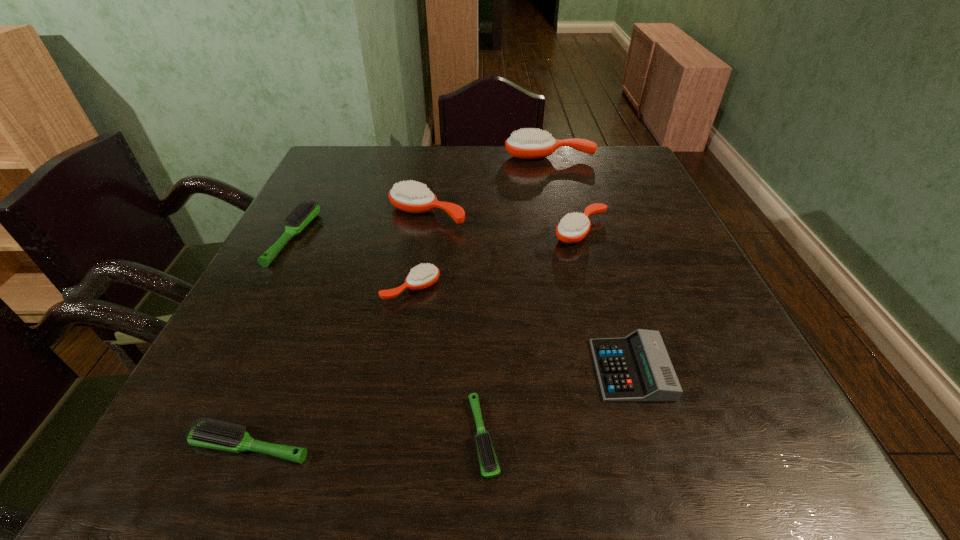
The image size is (960, 540). What are the coordinates of `vacant region located 0.220m on the right of the third hairbrush from right to left` in the screenshot? It's located at (644, 436).

Find the location of a particular element. The width and height of the screenshot is (960, 540). object that is at the far edge is located at coordinates (531, 143).

This screenshot has height=540, width=960. What are the coordinates of `hairbrush located in the right edge section of the desktop` in the screenshot? It's located at (531, 143).

You are a GUI agent. You are given a task and a screenshot of the screen. Output one action in this format:
    pyautogui.click(x=<x>, y=<y>)
    Task: Click on the calculator at the right edge
    The width and height of the screenshot is (960, 540).
    Given the screenshot: What is the action you would take?
    pyautogui.click(x=637, y=368)

I want to click on object that is positioned at the near left corner, so click(x=210, y=434).

Where is `object located at the far right corner`? object located at the far right corner is located at coordinates (531, 143).

The image size is (960, 540). Identify the location of vacant space at the far edge. (509, 174).

Where is `free space at the near edge of the desktop`? This screenshot has width=960, height=540. free space at the near edge of the desktop is located at coordinates (464, 472).

Identify the location of vacant space at the left edge of the desktop. The width and height of the screenshot is (960, 540). (328, 248).

Find the location of a particular element. This screenshot has height=540, width=960. vacant space at the right edge of the desktop is located at coordinates (714, 407).